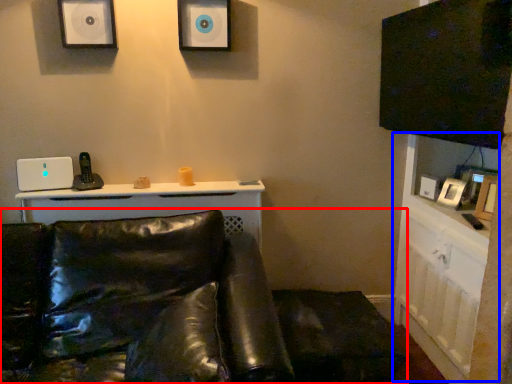
Question: Which of the following is the closest to the observer, studio couch (highlighted by a red box) or dresser (highlighted by a blue box)?

Choices:
 (A) studio couch
 (B) dresser

Answer: (A)